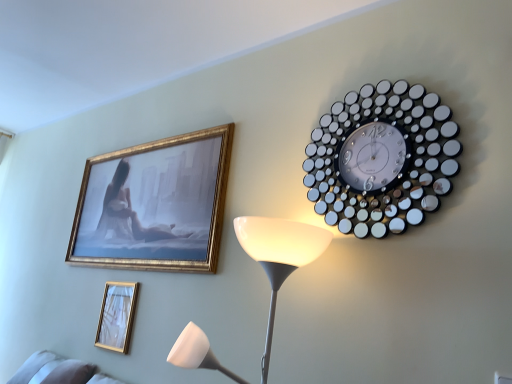
Describe the element at coordinates (117, 316) in the screenshot. I see `gold metallic picture frame at lower left` at that location.

You are a GUI agent. You are given a task and a screenshot of the screen. Output one action in this format:
    pyautogui.click(x=<x>, y=<y>)
    Task: Click on the gold metallic picture frame at lower left
    
    Given the screenshot: What is the action you would take?
    pyautogui.click(x=117, y=316)

Measure the distance between gold metallic picture frame at lower left and camera.

The depth of gold metallic picture frame at lower left is 1.72 meters.

Describe the element at coordinates (382, 159) in the screenshot. Image resolution: width=512 pixels, height=384 pixels. I see `metallic circular clock at upper right` at that location.

I want to click on metallic circular clock at upper right, so click(382, 159).

Identify the location of gold metallic picture frame at lower left. Image resolution: width=512 pixels, height=384 pixels. (117, 316).

In the image, is gold metallic picture frame at lower left on the left side or the right side of metallic circular clock at upper right?

In the image, gold metallic picture frame at lower left appears on the left side of metallic circular clock at upper right.

From the picture: Which is in front, gold metallic picture frame at lower left or metallic circular clock at upper right?

metallic circular clock at upper right is in front.

Is point (121, 348) closer or farther from the camera than point (395, 191)?

Clearly, point (121, 348) is more distant from the camera than point (395, 191).

From the image's perspective, is gold metallic picture frame at lower left on top of metallic circular clock at upper right?

Actually, gold metallic picture frame at lower left appears below metallic circular clock at upper right in the image.

From a real-world perspective, does gold metallic picture frame at lower left sit lower than metallic circular clock at upper right?

Yes.

Between gold metallic picture frame at lower left and metallic circular clock at upper right, which one has larger width?

metallic circular clock at upper right.

Considering the sizes of gold metallic picture frame at lower left and metallic circular clock at upper right in the image, is gold metallic picture frame at lower left taller or shorter than metallic circular clock at upper right?

In the image, gold metallic picture frame at lower left appears to be shorter than metallic circular clock at upper right.

Who is smaller, gold metallic picture frame at lower left or metallic circular clock at upper right?

gold metallic picture frame at lower left.

Is gold metallic picture frame at lower left spatially inside metallic circular clock at upper right, or outside of it?

The correct answer is: outside.

Is gold metallic picture frame at lower left not close to metallic circular clock at upper right?

Indeed, gold metallic picture frame at lower left is not near metallic circular clock at upper right.

Is gold metallic picture frame at lower left aimed at metallic circular clock at upper right?

No, gold metallic picture frame at lower left is not oriented towards metallic circular clock at upper right.

You are a GUI agent. You are given a task and a screenshot of the screen. Output one action in this format:
    pyautogui.click(x=<x>, y=<y>)
    Task: Click on the wall clock lying on the right of gold metallic picture frame at lower left
    Image resolution: width=512 pixels, height=384 pixels.
    Given the screenshot: What is the action you would take?
    pyautogui.click(x=382, y=159)

Does metallic circular clock at upper right appear on the right side of gold metallic picture frame at lower left?

Correct, you'll find metallic circular clock at upper right to the right of gold metallic picture frame at lower left.

Considering the positions of objects metallic circular clock at upper right and gold metallic picture frame at lower left in the image provided, who is in front, metallic circular clock at upper right or gold metallic picture frame at lower left?

metallic circular clock at upper right.

Which is in front, point (369, 99) or point (100, 320)?

The point (369, 99) is closer.

From the image's perspective, does metallic circular clock at upper right appear higher than gold metallic picture frame at lower left?

Yes, from the image's perspective, metallic circular clock at upper right is over gold metallic picture frame at lower left.

Based on the photo, from a real-world perspective, between metallic circular clock at upper right and gold metallic picture frame at lower left, who is vertically higher?

From a 3D spatial view, metallic circular clock at upper right is above.

Which object is wider, metallic circular clock at upper right or gold metallic picture frame at lower left?

metallic circular clock at upper right.

In terms of height, does metallic circular clock at upper right look taller or shorter compared to gold metallic picture frame at lower left?

Considering their sizes, metallic circular clock at upper right has more height than gold metallic picture frame at lower left.

Considering the relative sizes of metallic circular clock at upper right and gold metallic picture frame at lower left in the image provided, is metallic circular clock at upper right bigger than gold metallic picture frame at lower left?

Yes.

Does metallic circular clock at upper right contain gold metallic picture frame at lower left?

No, gold metallic picture frame at lower left is not a part of metallic circular clock at upper right.

Is metallic circular clock at upper right directly adjacent to gold metallic picture frame at lower left?

metallic circular clock at upper right and gold metallic picture frame at lower left are clearly separated.

Consider the image. Is gold metallic picture frame at lower left at the back of metallic circular clock at upper right?

No, metallic circular clock at upper right's orientation is not away from gold metallic picture frame at lower left.

How different are the orientations of metallic circular clock at upper right and gold metallic picture frame at lower left in degrees?

The angle between the facing direction of metallic circular clock at upper right and the facing direction of gold metallic picture frame at lower left is 1.02 degrees.

At what (x,y) coordinates should I click in order to perform the action: click on picture frame that is under the metallic circular clock at upper right (from a real-world perspective). Please return your answer as a coordinate pair (x, y). Looking at the image, I should click on (117, 316).

Image resolution: width=512 pixels, height=384 pixels. What are the coordinates of `wall clock above the gold metallic picture frame at lower left (from a real-world perspective)` in the screenshot? It's located at (382, 159).

The image size is (512, 384). What are the coordinates of `picture frame below the metallic circular clock at upper right (from a real-world perspective)` in the screenshot? It's located at (117, 316).